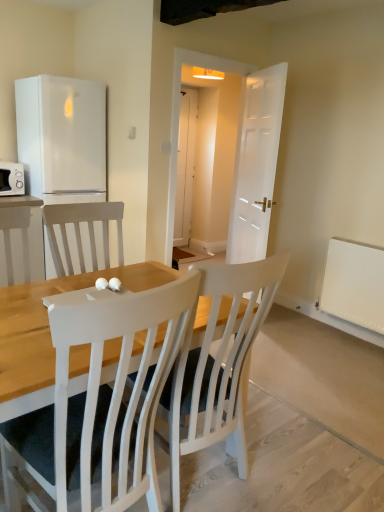
Identify the location of free space underneath white matte radiator at lower right (from a real-world perspective). This screenshot has height=512, width=384. (350, 335).